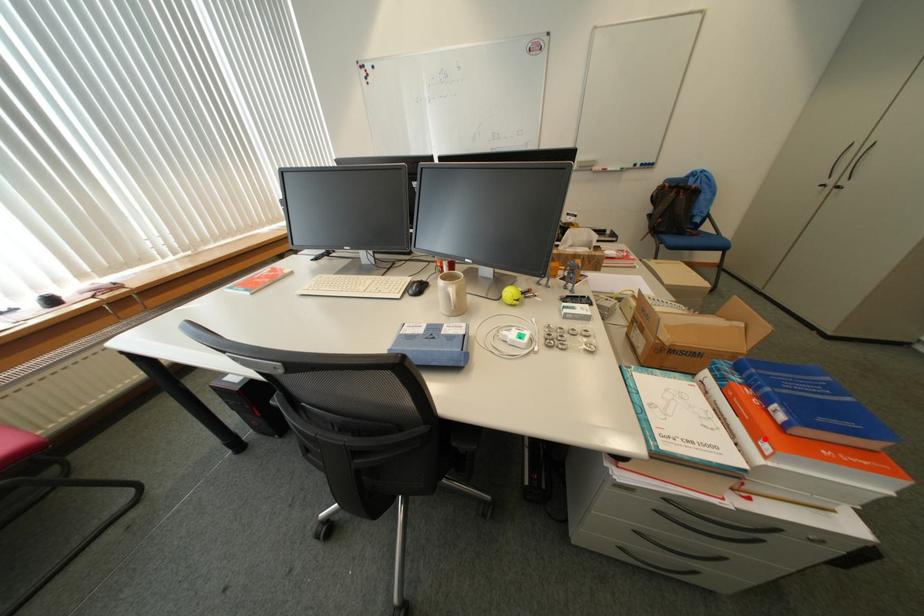
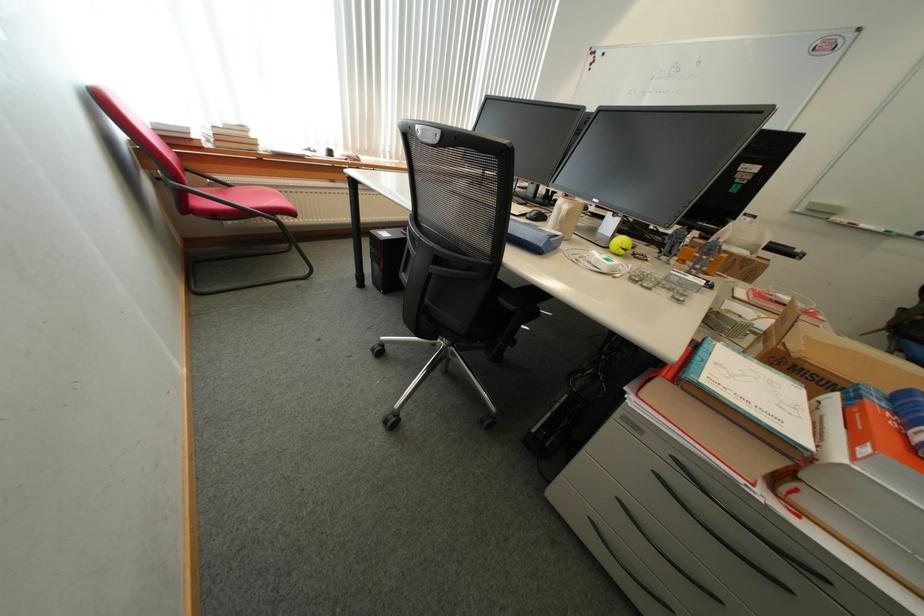
Locate, in the second image, the point that corresponds to the highlighted location in the first image.

(864, 446)